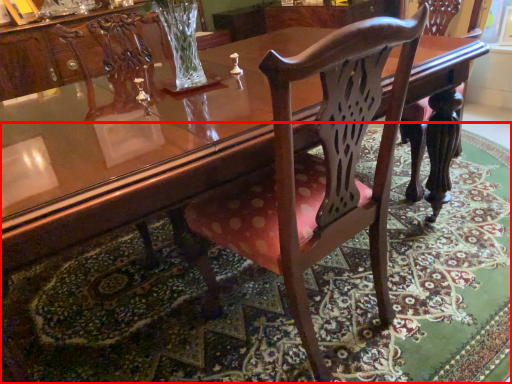
Question: From the image's perspective, where is mat (annotated by the red box) located in relation to chair in the image?

Choices:
 (A) below
 (B) above

Answer: (A)